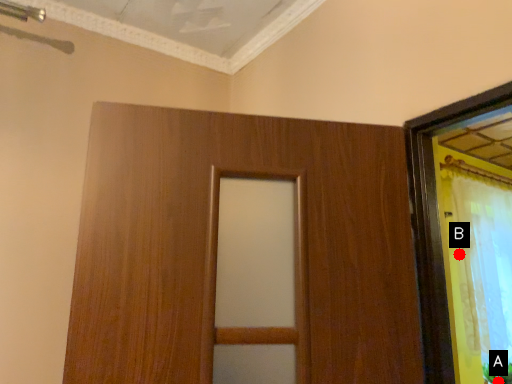
Question: Two points are circled on the image, labeled by A and B beside each circle. Which point is closer to the camera taking this photo?

Choices:
 (A) A is closer
 (B) B is closer

Answer: (B)